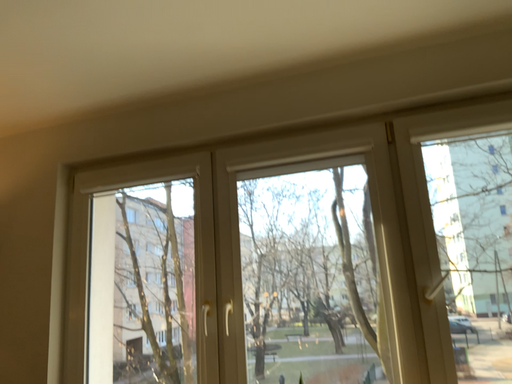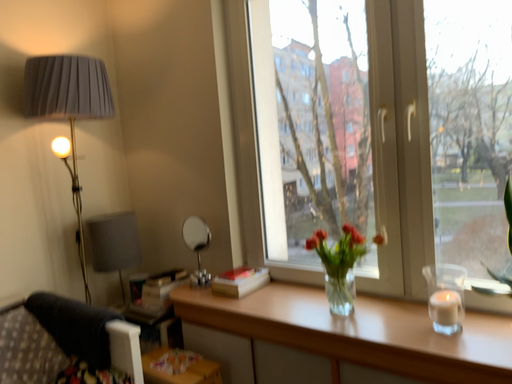
Question: Which way did the camera rotate in the video?

Choices:
 (A) rotated right
 (B) rotated left

Answer: (B)